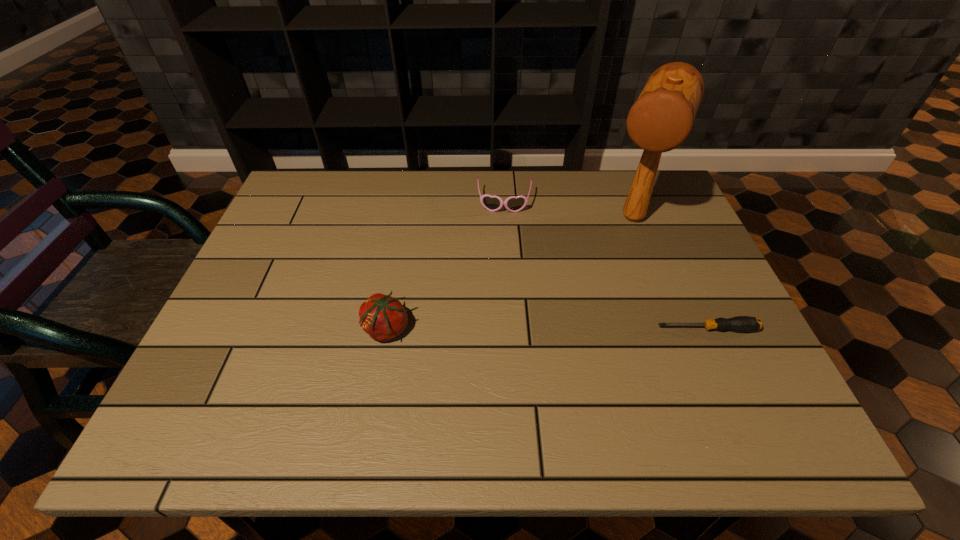
Where is `vacant space located 0.200m on the strike surface of the mallet`? The image size is (960, 540). vacant space located 0.200m on the strike surface of the mallet is located at coordinates (604, 293).

What are the coordinates of `vacant space located on the strike surface of the mallet` in the screenshot? It's located at (601, 299).

Locate an element on the screen. free spot located 0.150m on the front-facing side of the second object from left to right is located at coordinates (502, 251).

At what (x,y) coordinates should I click in order to perform the action: click on vacant area located 0.300m on the front-facing side of the second object from left to right. Please return your answer as a coordinate pair (x, y). The image size is (960, 540). Looking at the image, I should click on 501,293.

The image size is (960, 540). In order to click on free space located on the front-facing side of the second object from left to right in this screenshot , I will do click(502, 245).

What are the coordinates of `mallet present at the far edge` in the screenshot? It's located at (661, 119).

I want to click on sunglasses at the far edge, so click(492, 203).

In order to click on screwdriver that is at the right edge in this screenshot , I will do `click(739, 323)`.

Identify the location of mallet that is at the right edge. (661, 119).

At what (x,y) coordinates should I click in order to perform the action: click on object present at the far right corner. Please return your answer as a coordinate pair (x, y). This screenshot has width=960, height=540. Looking at the image, I should click on (661, 119).